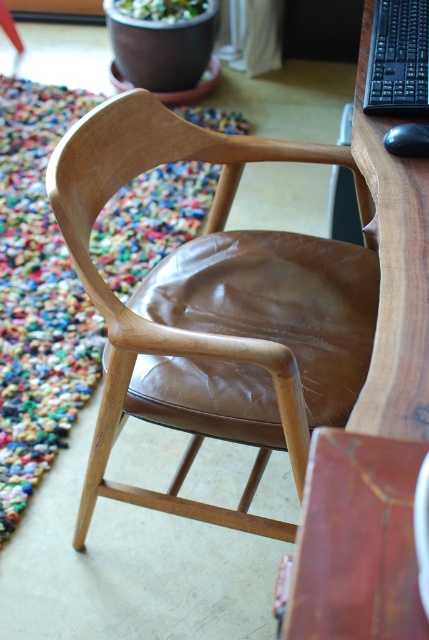
You are sitting in the brown leather armchair at center and want to reach the wooden computer desk at right. Which direction should you move to get there?

You should move to the right because the brown leather armchair at center is to the left of the wooden computer desk at right.

You are sitting in the brown leather armchair at center and want to reach the black plastic keyboard at upper right. Can you easily reach it without moving from the chair?

The brown leather armchair at center is in front of the black plastic keyboard at upper right, so you can easily reach it without moving from the chair.

You are a person who is 1.7 meters tall. You are sitting on the chair and want to place your hands on the black plastic keyboard at upper right. Considering the height of the wooden computer desk at right and the keyboard, will your arms be comfortable while typing?

The wooden computer desk at right is taller than the black plastic keyboard at upper right. Since the desk is higher, your arms might be slightly elevated when reaching for the keyboard, which could cause discomfort during prolonged typing. Adjusting the desk height or using a keyboard tray might help improve ergonomics.